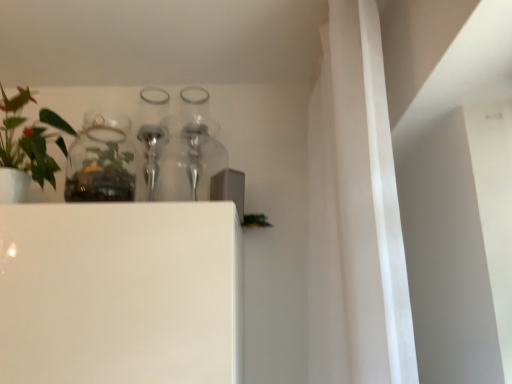
Question: In terms of height, does green matte plant at left look taller or shorter compared to clear glass bottle at upper center?

Choices:
 (A) short
 (B) tall

Answer: (A)

Question: From the image's perspective, is green matte plant at left above or below clear glass bottle at upper center?

Choices:
 (A) above
 (B) below

Answer: (A)

Question: Which object is positioned farthest from the clear glass bottle at upper center?

Choices:
 (A) green matte plant at left
 (B) clear glass jar at upper left

Answer: (A)

Question: Which of these objects is positioned closest to the clear glass bottle at upper center?

Choices:
 (A) clear glass jar at upper left
 (B) green matte plant at left

Answer: (A)